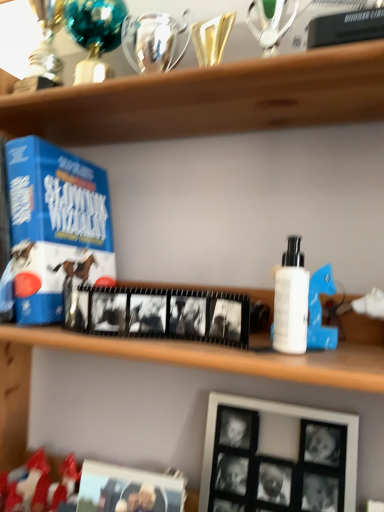
Question: In terms of height, does white matte bottle at right look taller or shorter compared to blue cardboard game at left?

Choices:
 (A) short
 (B) tall

Answer: (A)

Question: Do you think white matte bottle at right is within blue cardboard game at left, or outside of it?

Choices:
 (A) outside
 (B) inside

Answer: (A)

Question: Which object is positioned farthest from the black matte picture frame at lower right, which is counted as the first picture frame, starting from the right?

Choices:
 (A) blue cardboard game at left
 (B) black matte picture frame at lower center, which ranks as the first picture frame in left-to-right order
 (C) white matte bottle at right

Answer: (A)

Question: Which is nearer to the blue cardboard game at left?

Choices:
 (A) black matte picture frame at lower center, which ranks as the first picture frame in left-to-right order
 (B) black matte picture frame at lower right, which is the 2th picture frame from left to right
 (C) white matte bottle at right

Answer: (A)